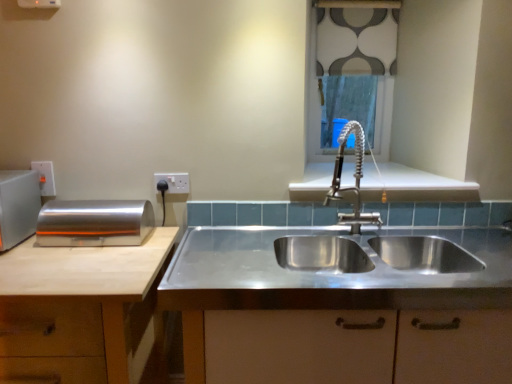
At what (x,y) coordinates should I click in order to perform the action: click on white plastic electric outlet at upper center, the second electric outlet from the left. Please return your answer as a coordinate pair (x, y). Looking at the image, I should click on (173, 182).

Describe the element at coordinates (355, 179) in the screenshot. I see `satin nickel faucet at center` at that location.

Measure the distance between patterned fabric at upper center and camera.

The distance of patterned fabric at upper center from camera is 7.36 feet.

Where is `stainless steel sink at center`? stainless steel sink at center is located at coordinates (260, 305).

In order to face stainless steel sink at center, should I rotate leftwards or rightwards?

Rotate your view right by about 14.660°.

This screenshot has width=512, height=384. Find the location of `stainless steel sink at center`. stainless steel sink at center is located at coordinates (424, 255).

Considering the sizes of stainless steel sink at center and silver metallic breadbox at left, acting as the second appliance starting from the left, in the image, is stainless steel sink at center taller or shorter than silver metallic breadbox at left, acting as the second appliance starting from the left,?

stainless steel sink at center is taller than silver metallic breadbox at left, acting as the second appliance starting from the left.

Is stainless steel sink at center in front of or behind silver metallic breadbox at left, marked as the first appliance in a right-to-left arrangement, in the image?

Clearly, stainless steel sink at center is in front of silver metallic breadbox at left, marked as the first appliance in a right-to-left arrangement.

Is stainless steel sink at center positioned far away from silver metallic breadbox at left, acting as the second appliance starting from the left?

They are positioned close to each other.

Where is `countertop on the right of silver metallic breadbox at left, marked as the first appliance in a right-to-left arrangement`? The image size is (512, 384). countertop on the right of silver metallic breadbox at left, marked as the first appliance in a right-to-left arrangement is located at coordinates (260, 305).

Does satin silver toaster at left, acting as the 2th appliance starting from the right, touch stainless steel sink at center?

No, satin silver toaster at left, acting as the 2th appliance starting from the right, is not next to stainless steel sink at center.

Is satin silver toaster at left, acting as the 2th appliance starting from the right, not inside stainless steel sink at center?

Indeed, satin silver toaster at left, acting as the 2th appliance starting from the right, is completely outside stainless steel sink at center.

Which of these two, satin silver toaster at left, acting as the 2th appliance starting from the right, or stainless steel sink at center, is smaller?

satin silver toaster at left, acting as the 2th appliance starting from the right, is smaller.

Considering the positions of objects satin silver toaster at left, which appears as the first appliance when viewed from the left, and stainless steel sink at center in the image provided, who is in front, satin silver toaster at left, which appears as the first appliance when viewed from the left, or stainless steel sink at center?

stainless steel sink at center.

From a real-world perspective, is satin nickel faucet at center above or below patterned fabric at upper center?

Clearly, from a real-world perspective, satin nickel faucet at center is below patterned fabric at upper center.

Looking at this image, looking at their sizes, would you say satin nickel faucet at center is wider or thinner than patterned fabric at upper center?

Considering their sizes, satin nickel faucet at center looks broader than patterned fabric at upper center.

Is satin nickel faucet at center taller or shorter than patterned fabric at upper center?

In the image, satin nickel faucet at center appears to be shorter than patterned fabric at upper center.

Consider the image. From the image's perspective, is satin nickel faucet at center above patterned fabric at upper center?

No.

Is stainless steel sink at center touching white plastic electric outlet at upper left, the second electric outlet from the right?

stainless steel sink at center and white plastic electric outlet at upper left, the second electric outlet from the right, are clearly separated.

Based on their positions, is stainless steel sink at center located to the left or right of white plastic electric outlet at upper left, the first electric outlet from the left?

stainless steel sink at center is positioned on white plastic electric outlet at upper left, the first electric outlet from the left,'s right side.

From the stainless steel sink at center, count the 2nd electric outlet to the left and point to it. Please provide its 2D coordinates.

[(45, 177)]

Is point (13, 374) positioned before point (55, 190)?

That is True.

Considering the points (172, 185) and (113, 362), which point is in front, point (172, 185) or point (113, 362)?

Point (113, 362)

Based on the photo, considering the positions of objects white plastic electric outlet at upper center, the second electric outlet from the left, and light brown wood cabinet at left in the image provided, who is more to the right, white plastic electric outlet at upper center, the second electric outlet from the left, or light brown wood cabinet at left?

From the viewer's perspective, white plastic electric outlet at upper center, the second electric outlet from the left, appears more on the right side.

Looking at this image, from the image's perspective, which is above, white plastic electric outlet at upper center, marked as the first electric outlet in a right-to-left arrangement, or light brown wood cabinet at left?

white plastic electric outlet at upper center, marked as the first electric outlet in a right-to-left arrangement, is shown above in the image.

Is white plastic electric outlet at upper center, marked as the first electric outlet in a right-to-left arrangement, inside the boundaries of light brown wood cabinet at left, or outside?

white plastic electric outlet at upper center, marked as the first electric outlet in a right-to-left arrangement, is spatially situated outside light brown wood cabinet at left.

From a real-world perspective, is silver metallic breadbox at left, marked as the first appliance in a right-to-left arrangement, positioned under stainless steel sink at center based on gravity?

No, from a real-world perspective, silver metallic breadbox at left, marked as the first appliance in a right-to-left arrangement, is not below stainless steel sink at center.

In the image, is silver metallic breadbox at left, marked as the first appliance in a right-to-left arrangement, on the left side or the right side of stainless steel sink at center?

Clearly, silver metallic breadbox at left, marked as the first appliance in a right-to-left arrangement, is on the left of stainless steel sink at center in the image.

What's the angular difference between silver metallic breadbox at left, marked as the first appliance in a right-to-left arrangement, and stainless steel sink at center's facing directions?

silver metallic breadbox at left, marked as the first appliance in a right-to-left arrangement, and stainless steel sink at center are facing 0.307 degrees away from each other.

Which of these two, silver metallic breadbox at left, acting as the second appliance starting from the left, or stainless steel sink at center, is smaller?

With smaller size is silver metallic breadbox at left, acting as the second appliance starting from the left.

Is light brown wood cabinet at left surrounding white plastic electric outlet at upper left, the second electric outlet from the right?

No, white plastic electric outlet at upper left, the second electric outlet from the right, is located outside of light brown wood cabinet at left.

Is point (33, 250) positioned before point (44, 189)?

Yes, it is.

From the image's perspective, starting from the light brown wood cabinet at left, which electric outlet is the 2nd one above? Please provide its 2D coordinates.

[(45, 177)]

Considering the sizes of objects light brown wood cabinet at left and white plastic electric outlet at upper left, the second electric outlet from the right, in the image provided, who is bigger, light brown wood cabinet at left or white plastic electric outlet at upper left, the second electric outlet from the right,?

With larger size is light brown wood cabinet at left.

Locate an element on the screen. This screenshot has height=384, width=512. countertop beneath the silver metallic breadbox at left, acting as the second appliance starting from the left (from a real-world perspective) is located at coordinates [260, 305].

Identify the location of appliance that is the 1st object located behind the stainless steel sink at center. This screenshot has height=384, width=512. [18, 206].

From the image, which object appears to be nearer to white plastic electric outlet at upper left, the first electric outlet from the left, satin silver toaster at left, acting as the 2th appliance starting from the right, or patterned fabric at upper center?

satin silver toaster at left, acting as the 2th appliance starting from the right, is closer to white plastic electric outlet at upper left, the first electric outlet from the left.

When comparing their distances from light brown wood cabinet at left, does patterned fabric at upper center or silver metallic breadbox at left, acting as the second appliance starting from the left, seem further?

patterned fabric at upper center.

Estimate the real-world distances between objects in this image. Which object is further from white plastic electric outlet at upper left, the first electric outlet from the left, white plastic electric outlet at upper center, marked as the first electric outlet in a right-to-left arrangement, or silver metallic breadbox at left, marked as the first appliance in a right-to-left arrangement?

Among the two, white plastic electric outlet at upper center, marked as the first electric outlet in a right-to-left arrangement, is located further to white plastic electric outlet at upper left, the first electric outlet from the left.

When comparing their distances from silver metallic breadbox at left, acting as the second appliance starting from the left, does white plastic electric outlet at upper left, the first electric outlet from the left, or patterned fabric at upper center seem further?

Among the two, patterned fabric at upper center is located further to silver metallic breadbox at left, acting as the second appliance starting from the left.

Looking at this image, when comparing their distances from silver metallic breadbox at left, acting as the second appliance starting from the left, does white plastic electric outlet at upper center, the second electric outlet from the left, or white plastic electric outlet at upper left, the first electric outlet from the left, seem closer?

Among the two, white plastic electric outlet at upper center, the second electric outlet from the left, is located nearer to silver metallic breadbox at left, acting as the second appliance starting from the left.

Based on their spatial positions, is stainless steel sink at center or white plastic electric outlet at upper center, marked as the first electric outlet in a right-to-left arrangement, further from satin nickel faucet at center?

Based on the image, white plastic electric outlet at upper center, marked as the first electric outlet in a right-to-left arrangement, appears to be further to satin nickel faucet at center.

Which object lies further to the anchor point satin silver toaster at left, which appears as the first appliance when viewed from the left, patterned fabric at upper center or silver metallic breadbox at left, acting as the second appliance starting from the left?

patterned fabric at upper center is positioned further to the anchor satin silver toaster at left, which appears as the first appliance when viewed from the left.

Looking at the image, which one is located further to white plastic electric outlet at upper center, the second electric outlet from the left, white plastic electric outlet at upper left, the first electric outlet from the left, or silver metallic breadbox at left, acting as the second appliance starting from the left?

Among the two, white plastic electric outlet at upper left, the first electric outlet from the left, is located further to white plastic electric outlet at upper center, the second electric outlet from the left.

This screenshot has width=512, height=384. In order to click on sink situated between white plastic electric outlet at upper left, the second electric outlet from the right, and patterned fabric at upper center from left to right in this screenshot , I will do `click(424, 255)`.

You are a GUI agent. You are given a task and a screenshot of the screen. Output one action in this format:
    pyautogui.click(x=<x>, y=<y>)
    Task: Click on the electric outlet between silver metallic breadbox at left, marked as the first appliance in a right-to-left arrangement, and satin nickel faucet at center, in the horizontal direction
    
    Given the screenshot: What is the action you would take?
    pos(173,182)

Where is `electric outlet located between silver metallic breadbox at left, acting as the second appliance starting from the left, and stainless steel sink at center in the left-right direction`? The width and height of the screenshot is (512, 384). electric outlet located between silver metallic breadbox at left, acting as the second appliance starting from the left, and stainless steel sink at center in the left-right direction is located at coordinates (173, 182).

The image size is (512, 384). Find the location of `tap between white plastic electric outlet at upper center, the second electric outlet from the left, and patterned fabric at upper center`. tap between white plastic electric outlet at upper center, the second electric outlet from the left, and patterned fabric at upper center is located at coordinates (355, 179).